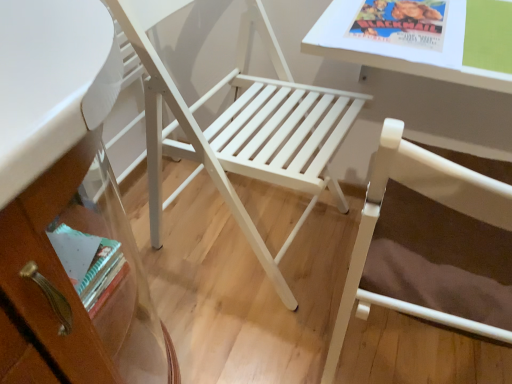
Identify the location of vacant region below white wood chair at center, which ranks as the 1th chair in right-to-left order (from a real-world perspective). This screenshot has height=384, width=512. (409, 354).